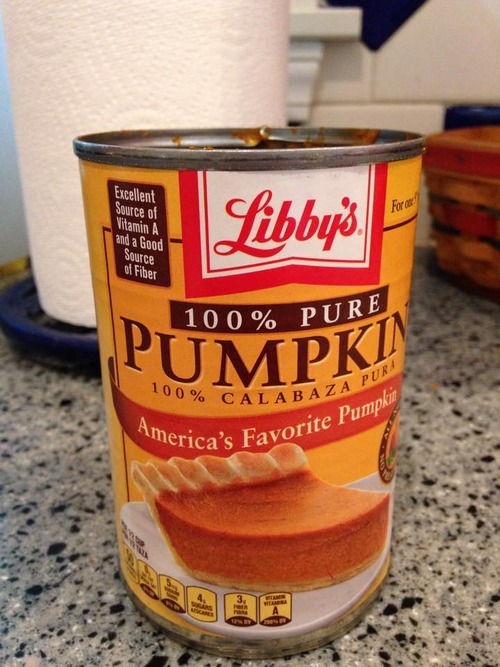
The width and height of the screenshot is (500, 667). In order to click on paper towels in this screenshot , I will do `click(68, 285)`, `click(68, 229)`, `click(49, 137)`, `click(128, 59)`, `click(47, 21)`, `click(189, 81)`, `click(248, 25)`.